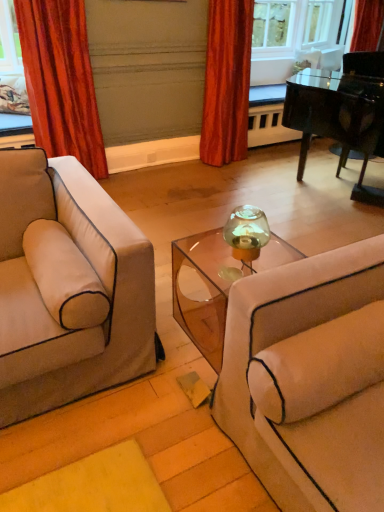
Question: Considering the relative sizes of velvet orange curtain at left, marked as the second curtain in a right-to-left arrangement, and beige fabric pillow at right in the image provided, is velvet orange curtain at left, marked as the second curtain in a right-to-left arrangement, taller than beige fabric pillow at right?

Choices:
 (A) no
 (B) yes

Answer: (B)

Question: Is velvet orange curtain at left, marked as the second curtain in a right-to-left arrangement, to the right of beige fabric pillow at right from the viewer's perspective?

Choices:
 (A) yes
 (B) no

Answer: (B)

Question: Is velvet orange curtain at left, marked as the second curtain in a right-to-left arrangement, far away from beige fabric pillow at right?

Choices:
 (A) no
 (B) yes

Answer: (B)

Question: Is beige fabric pillow at right a part of velvet orange curtain at left, marked as the second curtain in a right-to-left arrangement?

Choices:
 (A) no
 (B) yes

Answer: (A)

Question: Does velvet orange curtain at left, placed as the 1th curtain when sorted from left to right, have a smaller size compared to beige fabric pillow at right?

Choices:
 (A) yes
 (B) no

Answer: (B)

Question: Is shiny black piano at upper right situated inside velvet orange curtain at left, placed as the 1th curtain when sorted from left to right, or outside?

Choices:
 (A) inside
 (B) outside

Answer: (B)

Question: Relative to velvet orange curtain at left, placed as the 1th curtain when sorted from left to right, is shiny black piano at upper right in front or behind?

Choices:
 (A) behind
 (B) front

Answer: (A)

Question: From a real-world perspective, is shiny black piano at upper right physically located above or below velvet orange curtain at left, placed as the 1th curtain when sorted from left to right?

Choices:
 (A) above
 (B) below

Answer: (A)

Question: In terms of height, does shiny black piano at upper right look taller or shorter compared to velvet orange curtain at left, placed as the 1th curtain when sorted from left to right?

Choices:
 (A) short
 (B) tall

Answer: (B)

Question: Is point (230, 22) closer or farther from the camera than point (352, 57)?

Choices:
 (A) closer
 (B) farther

Answer: (B)

Question: From the image's perspective, is velvet red curtain at upper center, the first curtain when ordered from right to left, above or below shiny black piano at upper right?

Choices:
 (A) above
 (B) below

Answer: (B)

Question: Do you think velvet red curtain at upper center, the first curtain when ordered from right to left, is within shiny black piano at upper right, or outside of it?

Choices:
 (A) outside
 (B) inside

Answer: (A)

Question: Considering their positions, is velvet red curtain at upper center, the first curtain when ordered from right to left, located in front of or behind shiny black piano at upper right?

Choices:
 (A) behind
 (B) front

Answer: (B)

Question: From a real-world perspective, is velvet red curtain at upper center, the second curtain when ordered from left to right, above or below velvet orange curtain at left, marked as the second curtain in a right-to-left arrangement?

Choices:
 (A) below
 (B) above

Answer: (B)

Question: Considering the positions of velvet red curtain at upper center, the second curtain when ordered from left to right, and velvet orange curtain at left, placed as the 1th curtain when sorted from left to right, in the image, is velvet red curtain at upper center, the second curtain when ordered from left to right, wider or thinner than velvet orange curtain at left, placed as the 1th curtain when sorted from left to right,?

Choices:
 (A) wide
 (B) thin

Answer: (B)